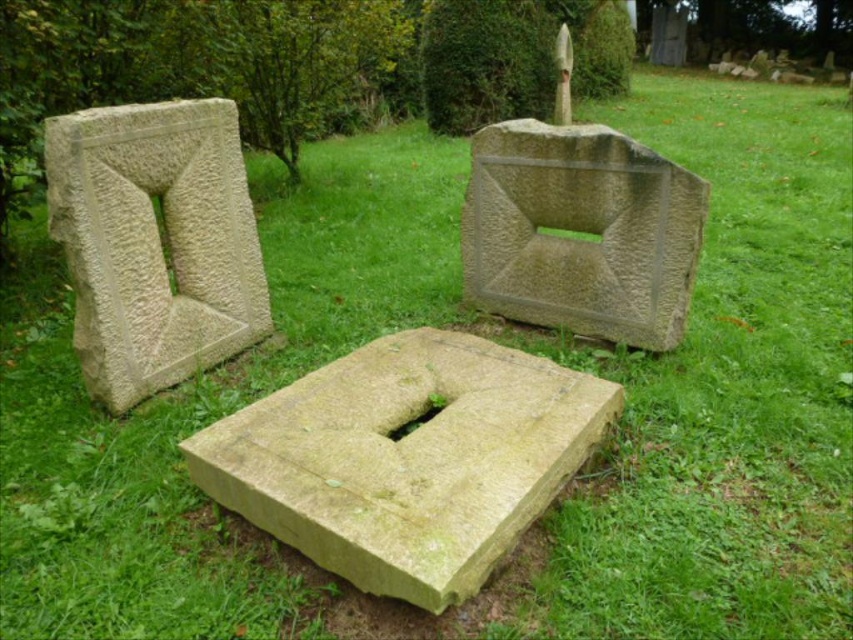
Which is more to the left, yellowish stone block at center or beige rough stone at left?

From the viewer's perspective, beige rough stone at left appears more on the left side.

Can you confirm if yellowish stone block at center is taller than beige rough stone at left?

No, yellowish stone block at center is not taller than beige rough stone at left.

Where is `yellowish stone block at center`? The width and height of the screenshot is (853, 640). yellowish stone block at center is located at coordinates click(x=407, y=460).

Can you confirm if beige rough stone at left is shorter than gray rough stone at upper right?

In fact, beige rough stone at left may be taller than gray rough stone at upper right.

Based on the photo, does beige rough stone at left have a lesser width compared to gray rough stone at upper right?

Yes, beige rough stone at left is thinner than gray rough stone at upper right.

Does point (231, 291) come farther from viewer compared to point (691, 269)?

Yes, point (231, 291) is farther from viewer.

Locate an element on the screen. beige rough stone at left is located at coordinates (154, 243).

Can you confirm if yellowish stone block at center is positioned below gray rough stone at upper right?

Yes.

Who is higher up, yellowish stone block at center or gray rough stone at upper right?

Positioned higher is gray rough stone at upper right.

Which is in front, point (607, 422) or point (550, 195)?

Point (607, 422) is more forward.

The height and width of the screenshot is (640, 853). Find the location of `yellowish stone block at center`. yellowish stone block at center is located at coordinates (407, 460).